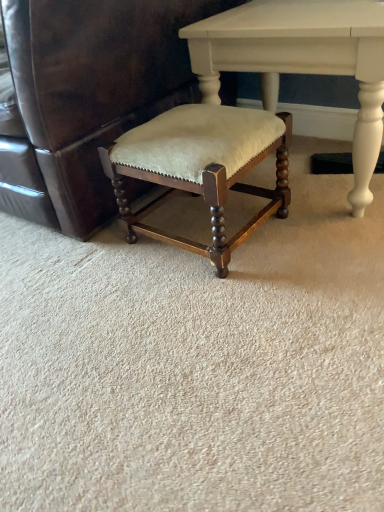
Identify the location of velvet beige stool at center. Image resolution: width=384 pixels, height=512 pixels. point(201,167).

Locate an element on the screen. Image resolution: width=384 pixels, height=512 pixels. velvet beige stool at center is located at coordinates (201, 167).

Find the location of `chair in front of the velvet beige stool at center`. chair in front of the velvet beige stool at center is located at coordinates (91, 91).

How different are the orientations of velvet beige cushioned stool at center and velvet beige stool at center in degrees?

The angle between the facing direction of velvet beige cushioned stool at center and the facing direction of velvet beige stool at center is 0.147 degrees.

Based on their sizes in the image, would you say velvet beige cushioned stool at center is bigger or smaller than velvet beige stool at center?

Clearly, velvet beige cushioned stool at center is larger in size than velvet beige stool at center.

Is point (180, 106) closer or farther from the camera than point (375, 154)?

Clearly, point (180, 106) is more distant from the camera than point (375, 154).

Is velvet beige stool at center far away from matte white table at center?

No.

Between velvet beige stool at center and matte white table at center, which one has smaller width?

With smaller width is velvet beige stool at center.

Find the location of `table behind the velvet beige stool at center`. table behind the velvet beige stool at center is located at coordinates (301, 60).

Is velvet beige stool at center in contact with velvet beige cushioned stool at center?

No, velvet beige stool at center is not with velvet beige cushioned stool at center.

The image size is (384, 512). Identify the location of chair that appears above the velvet beige stool at center (from the image's perspective). (91, 91).

Which is more to the right, velvet beige stool at center or velvet beige cushioned stool at center?

velvet beige stool at center.

Which of these two, velvet beige cushioned stool at center or matte white table at center, is bigger?

With larger size is velvet beige cushioned stool at center.

Consider the image. In terms of width, does velvet beige cushioned stool at center look wider or thinner when compared to matte white table at center?

velvet beige cushioned stool at center is wider than matte white table at center.

From the image's perspective, is velvet beige cushioned stool at center on top of matte white table at center?

Indeed, from the image's perspective, velvet beige cushioned stool at center is shown above matte white table at center.

Is velvet beige cushioned stool at center positioned beyond the bounds of matte white table at center?

Yes, velvet beige cushioned stool at center is not within matte white table at center.

Which of these two, matte white table at center or velvet beige stool at center, is smaller?

Smaller between the two is velvet beige stool at center.

Choose the correct answer: Is matte white table at center inside velvet beige stool at center or outside it?

matte white table at center is located beyond the bounds of velvet beige stool at center.

Which is closer to the camera, (293, 11) or (220, 268)?

The point (220, 268) is more forward.

Can you confirm if matte white table at center is positioned to the right of velvet beige cushioned stool at center?

Indeed, matte white table at center is positioned on the right side of velvet beige cushioned stool at center.

Which of these two, matte white table at center or velvet beige cushioned stool at center, stands taller?

With more height is velvet beige cushioned stool at center.

Does point (329, 55) appear closer or farther from the camera than point (116, 9)?

Point (329, 55) is farther from the camera than point (116, 9).

Which object is further away from the camera taking this photo, matte white table at center or velvet beige cushioned stool at center?

matte white table at center.

You are a GUI agent. You are given a task and a screenshot of the screen. Output one action in this format:
    pyautogui.click(x=<x>, y=<y>)
    Task: Click on the chair in front of the velvet beige stool at center
    The image size is (384, 512).
    Given the screenshot: What is the action you would take?
    pyautogui.click(x=91, y=91)

You are a GUI agent. You are given a task and a screenshot of the screen. Output one action in this format:
    pyautogui.click(x=<x>, y=<y>)
    Task: Click on the table above the velvet beige stool at center (from a real-world perspective)
    This screenshot has height=512, width=384.
    Given the screenshot: What is the action you would take?
    pyautogui.click(x=301, y=60)

Looking at the image, which one is located closer to matte white table at center, velvet beige cushioned stool at center or velvet beige stool at center?

velvet beige stool at center.

From the image, which object appears to be farther from velvet beige cushioned stool at center, matte white table at center or velvet beige stool at center?

matte white table at center.

From the image, which object appears to be farther from matte white table at center, velvet beige stool at center or velvet beige cushioned stool at center?

The object further to matte white table at center is velvet beige cushioned stool at center.

Considering their positions, is velvet beige stool at center positioned closer to velvet beige cushioned stool at center than matte white table at center?

Based on the image, velvet beige stool at center appears to be nearer to velvet beige cushioned stool at center.

Looking at the image, which one is located closer to velvet beige stool at center, matte white table at center or velvet beige cushioned stool at center?

velvet beige cushioned stool at center.

Based on their spatial positions, is velvet beige cushioned stool at center or matte white table at center closer to velvet beige stool at center?

velvet beige cushioned stool at center.

This screenshot has height=512, width=384. I want to click on bar stool between velvet beige cushioned stool at center and matte white table at center in the horizontal direction, so click(201, 167).